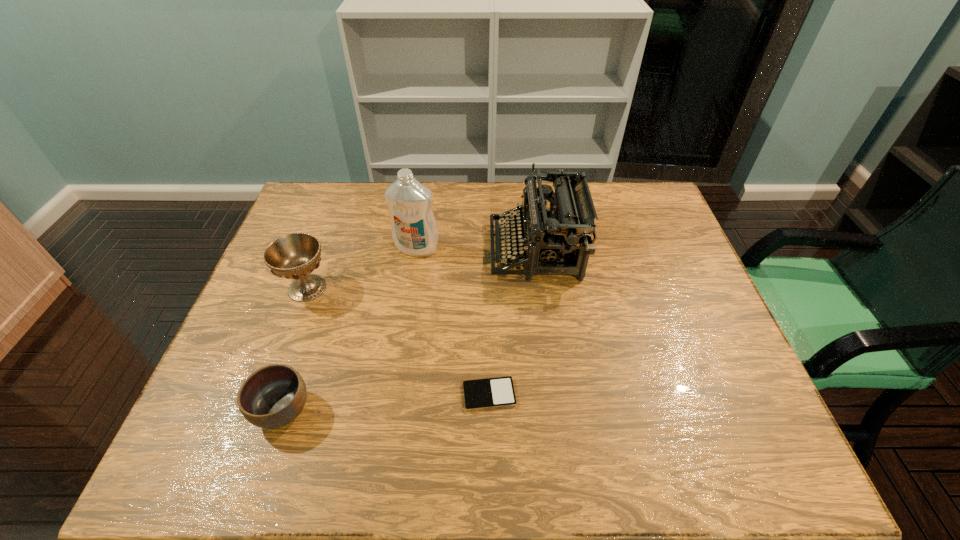
At what (x,y) coordinates should I click in order to perform the action: click on vacant space situated 0.200m on the front of the chalice. Please return your answer as a coordinate pair (x, y). Looking at the image, I should click on (276, 372).

Identify the location of free space located on the back of the bowl. (304, 345).

The height and width of the screenshot is (540, 960). Identify the location of vacant space located 0.130m on the back of the iPod. (489, 334).

Locate an element on the screen. Image resolution: width=960 pixels, height=540 pixels. object located at the far edge is located at coordinates (561, 235).

This screenshot has height=540, width=960. Find the location of `object at the near edge`. object at the near edge is located at coordinates [273, 396].

At what (x,y) coordinates should I click in order to perform the action: click on chalice located in the left edge section of the desktop. Please return your answer as a coordinate pair (x, y). Looking at the image, I should click on (295, 256).

Where is `bowl at the left edge`? The height and width of the screenshot is (540, 960). bowl at the left edge is located at coordinates (273, 396).

Locate an element on the screen. The width and height of the screenshot is (960, 540). object at the near left corner is located at coordinates (273, 396).

At what (x,y) coordinates should I click in order to perform the action: click on vacant area at the far edge. Please return your answer as a coordinate pair (x, y). Image resolution: width=960 pixels, height=540 pixels. Looking at the image, I should click on (471, 196).

Locate an element on the screen. vacant space at the near edge is located at coordinates (267, 474).